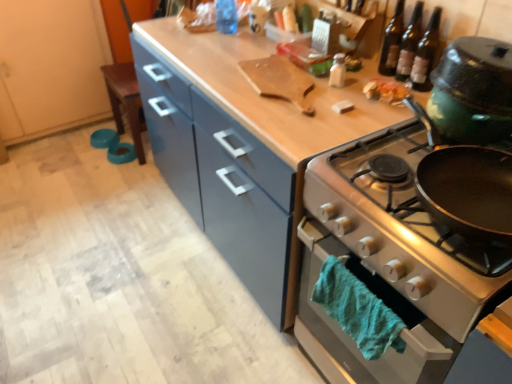
Where is `free space in front of white matte salt shaker at center, marked as the 1th bottle in a right-to-left arrangement`? Image resolution: width=512 pixels, height=384 pixels. free space in front of white matte salt shaker at center, marked as the 1th bottle in a right-to-left arrangement is located at coordinates (337, 113).